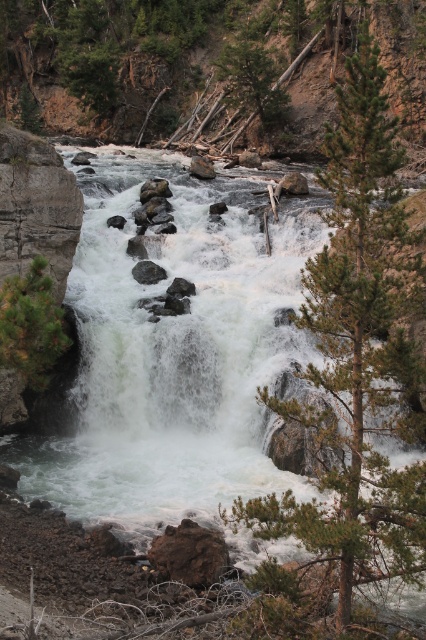
You are a hiker planning to cross the river using a narrow path that runs between the green matte tree at left and the gray smooth rock at center. The path is only 25 feet wide. Do you think you can safely pass through this path without getting too close to either the tree or the rock?

The distance between the green matte tree at left and the gray smooth rock at center is 28.04 feet. Since the path is 25 feet wide, there is a 3.04 feet gap remaining, which should allow safe passage as long as you stay centered on the path.